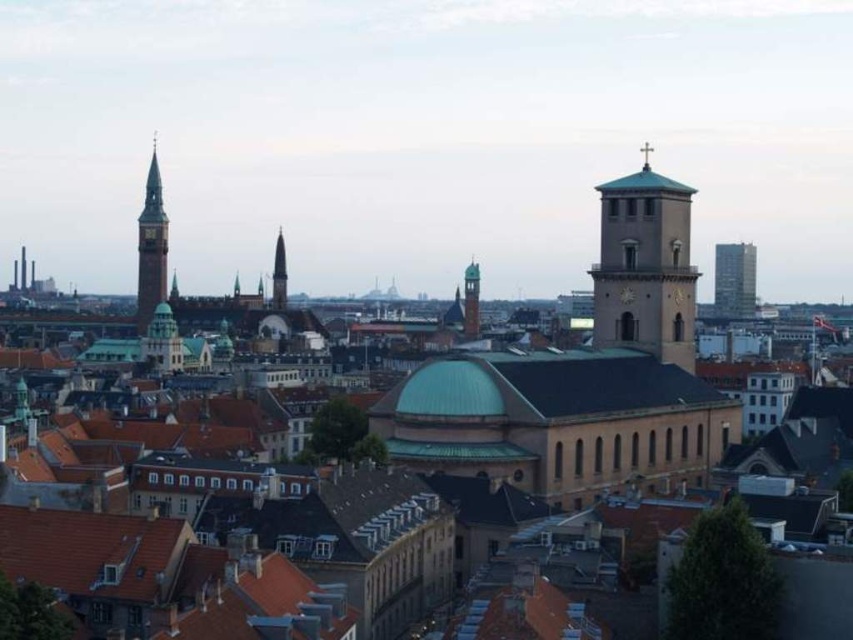
Does light brown stone bell tower at center right appear over smooth gold spire at center?

Yes.

Which is above, light brown stone bell tower at center right or smooth gold spire at center?

light brown stone bell tower at center right is higher up.

Does point (688, 337) come closer to viewer compared to point (282, 291)?

Yes.

What are the coordinates of `light brown stone bell tower at center right` in the screenshot? It's located at (645, 266).

Between smooth brown clock tower at left and green glass skyscraper at upper right, which one appears on the left side from the viewer's perspective?

smooth brown clock tower at left

Is smooth brown clock tower at left taller than green glass skyscraper at upper right?

Yes.

At what (x,y) coordinates should I click in order to perform the action: click on smooth brown clock tower at left. Please return your answer as a coordinate pair (x, y). Image resolution: width=853 pixels, height=640 pixels. Looking at the image, I should click on (151, 246).

Is point (155, 289) positioned after point (285, 260)?

No, it is not.

Who is shorter, smooth brown clock tower at left or smooth gold spire at center?

With less height is smooth gold spire at center.

I want to click on smooth brown clock tower at left, so click(x=151, y=246).

Locate an element on the screen. This screenshot has height=640, width=853. smooth brown clock tower at left is located at coordinates (151, 246).